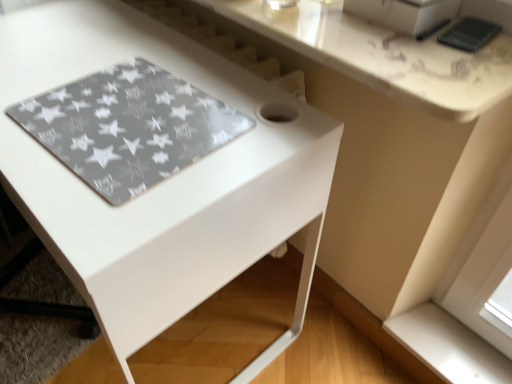
Question: Visually, is white glossy counter top at upper center positioned to the left or to the right of white smooth window sill at lower right?

Choices:
 (A) right
 (B) left

Answer: (B)

Question: Considering the positions of white glossy counter top at upper center and white smooth window sill at lower right in the image, is white glossy counter top at upper center taller or shorter than white smooth window sill at lower right?

Choices:
 (A) short
 (B) tall

Answer: (A)

Question: Considering the real-world distances, which object is farthest from the black matte phone at upper right?

Choices:
 (A) white glossy counter top at upper center
 (B) white glossy table at center
 (C) transparent star-patterned mat at lower left
 (D) white smooth window sill at lower right

Answer: (D)

Question: Which is farther from the white smooth window sill at lower right?

Choices:
 (A) white glossy table at center
 (B) white glossy counter top at upper center
 (C) black matte phone at upper right
 (D) transparent star-patterned mat at lower left

Answer: (D)